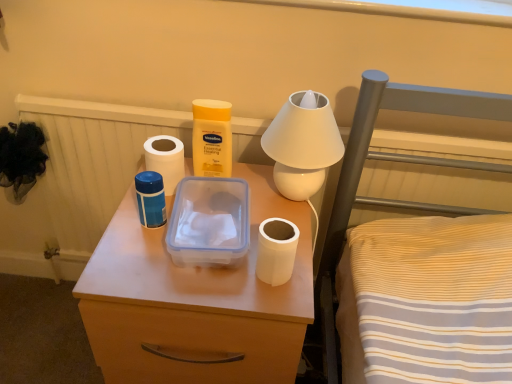
The width and height of the screenshot is (512, 384). In order to click on blue plastic thermos at center in this screenshot , I will do `click(151, 199)`.

What do you see at coordinates (276, 250) in the screenshot? This screenshot has width=512, height=384. I see `white matte toilet paper at center, arranged as the first toilet paper when viewed from the right` at bounding box center [276, 250].

What do you see at coordinates (302, 144) in the screenshot? Image resolution: width=512 pixels, height=384 pixels. I see `white glossy table lamp at upper center` at bounding box center [302, 144].

The image size is (512, 384). I want to click on white matte toilet paper at left, the 1th toilet paper positioned from the left, so click(165, 160).

Considering the positions of objects matte plastic container at center and blue plastic thermos at center in the image provided, who is more to the left, matte plastic container at center or blue plastic thermos at center?

blue plastic thermos at center.

From the image's perspective, is matte plastic container at center above or below blue plastic thermos at center?

Clearly, from the image's perspective, matte plastic container at center is below blue plastic thermos at center.

Considering the sizes of objects matte plastic container at center and blue plastic thermos at center in the image provided, who is thinner, matte plastic container at center or blue plastic thermos at center?

With smaller width is blue plastic thermos at center.

From a real-world perspective, is matte plastic container at center on top of blue plastic thermos at center?

No, from a real-world perspective, matte plastic container at center is not above blue plastic thermos at center.

Is white glossy table lamp at upper center facing towards white matte toilet paper at left, placed as the 1th toilet paper when sorted from back to front?

No, white glossy table lamp at upper center is not turned towards white matte toilet paper at left, placed as the 1th toilet paper when sorted from back to front.

Does white glossy table lamp at upper center have a smaller size compared to white matte toilet paper at left, positioned as the second toilet paper in bottom-to-top order?

No, white glossy table lamp at upper center is not smaller than white matte toilet paper at left, positioned as the second toilet paper in bottom-to-top order.

Is white glossy table lamp at upper center wider or thinner than white matte toilet paper at left, placed as the 1th toilet paper when sorted from back to front?

white glossy table lamp at upper center is wider than white matte toilet paper at left, placed as the 1th toilet paper when sorted from back to front.

Is white glossy table lamp at upper center shorter than white matte toilet paper at left, positioned as the second toilet paper in bottom-to-top order?

No.

Is white matte toilet paper at center, the second toilet paper viewed from the back, surrounding white glossy table lamp at upper center?

No, white glossy table lamp at upper center is not a part of white matte toilet paper at center, the second toilet paper viewed from the back.

Is white matte toilet paper at center, placed as the second toilet paper when sorted from left to right, to the left of white glossy table lamp at upper center from the viewer's perspective?

Indeed, white matte toilet paper at center, placed as the second toilet paper when sorted from left to right, is positioned on the left side of white glossy table lamp at upper center.

Is white matte toilet paper at center, which is the second toilet paper from top to bottom, positioned with its back to white glossy table lamp at upper center?

Yes.

Where is `table lamp behind the white matte toilet paper at center, arranged as the first toilet paper when viewed from the right`? This screenshot has width=512, height=384. table lamp behind the white matte toilet paper at center, arranged as the first toilet paper when viewed from the right is located at coordinates (302, 144).

How many degrees apart are the facing directions of blue plastic thermos at center and matte plastic container at center?

The angular difference between blue plastic thermos at center and matte plastic container at center is 0.00271 degrees.

Locate an element on the screen. Image resolution: width=512 pixels, height=384 pixels. cleaning product located above the matte plastic container at center (from the image's perspective) is located at coordinates (151, 199).

In the scene shown: From a real-world perspective, is blue plastic thermos at center positioned above or below matte plastic container at center?

blue plastic thermos at center is situated higher than matte plastic container at center in the real world.

Does point (151, 219) lie behind point (112, 352)?

That is True.

How far apart are white glossy table lamp at upper center and transparent plastic lunch box at center?

white glossy table lamp at upper center is 6.92 inches from transparent plastic lunch box at center.

Who is taller, white glossy table lamp at upper center or transparent plastic lunch box at center?

With more height is white glossy table lamp at upper center.

Is point (315, 171) more distant than point (220, 199)?

No, it is in front of (220, 199).

Is white glossy table lamp at upper center positioned before transparent plastic lunch box at center?

No, it is not.

Considering the relative sizes of blue plastic thermos at center and white glossy table lamp at upper center in the image provided, is blue plastic thermos at center taller than white glossy table lamp at upper center?

No, blue plastic thermos at center is not taller than white glossy table lamp at upper center.

Does blue plastic thermos at center appear on the right side of white glossy table lamp at upper center?

In fact, blue plastic thermos at center is to the left of white glossy table lamp at upper center.

From a real-world perspective, between blue plastic thermos at center and white glossy table lamp at upper center, who is vertically higher?

white glossy table lamp at upper center.

From the image's perspective, which object appears higher, blue plastic thermos at center or white glossy table lamp at upper center?

white glossy table lamp at upper center appears higher in the image.

Can you tell me how much blue plastic thermos at center and white matte toilet paper at center, arranged as the first toilet paper when viewed from the right, differ in facing direction?

The angular difference between blue plastic thermos at center and white matte toilet paper at center, arranged as the first toilet paper when viewed from the right, is 0.00211 degrees.

Is blue plastic thermos at center inside or outside of white matte toilet paper at center, placed as the second toilet paper when sorted from left to right?

blue plastic thermos at center is not enclosed by white matte toilet paper at center, placed as the second toilet paper when sorted from left to right.

This screenshot has width=512, height=384. I want to click on cleaning product located above the white matte toilet paper at center, which is the 1th toilet paper in bottom-to-top order (from a real-world perspective), so 151,199.

Considering the relative sizes of blue plastic thermos at center and white matte toilet paper at center, which is the second toilet paper from top to bottom, in the image provided, is blue plastic thermos at center thinner than white matte toilet paper at center, which is the second toilet paper from top to bottom,?

Correct, the width of blue plastic thermos at center is less than that of white matte toilet paper at center, which is the second toilet paper from top to bottom.

The width and height of the screenshot is (512, 384). In order to click on nightstand located on the right of blue plastic thermos at center in this screenshot , I will do [195, 302].

You are a GUI agent. You are given a task and a screenshot of the screen. Output one action in this format:
    pyautogui.click(x=<x>, y=<y>)
    Task: Click on the table lamp that appears above the white matte toilet paper at left, the second toilet paper from the front (from the image's perspective)
    The width and height of the screenshot is (512, 384).
    Given the screenshot: What is the action you would take?
    pyautogui.click(x=302, y=144)

When comparing their distances from white matte toilet paper at center, the second toilet paper viewed from the back, does transparent plastic lunch box at center or white glossy table lamp at upper center seem further?

white glossy table lamp at upper center is further to white matte toilet paper at center, the second toilet paper viewed from the back.

When comparing their distances from blue plastic thermos at center, does white matte toilet paper at left, arranged as the second toilet paper when viewed from the right, or matte plastic container at center seem closer?

white matte toilet paper at left, arranged as the second toilet paper when viewed from the right.

When comparing their distances from transparent plastic lunch box at center, does matte plastic container at center or white glossy table lamp at upper center seem closer?

The object closer to transparent plastic lunch box at center is matte plastic container at center.

From the image, which object appears to be nearer to white matte toilet paper at center, which is the second toilet paper from top to bottom, blue plastic thermos at center or white glossy table lamp at upper center?

white glossy table lamp at upper center is positioned closer to the anchor white matte toilet paper at center, which is the second toilet paper from top to bottom.

From the picture: Considering their positions, is blue plastic thermos at center positioned further to matte plastic container at center than white matte toilet paper at center, the second toilet paper viewed from the back?

Among the two, blue plastic thermos at center is located further to matte plastic container at center.

Which object lies further to the anchor point white matte toilet paper at center, the second toilet paper viewed from the back, blue plastic thermos at center or matte plastic container at center?

blue plastic thermos at center is positioned further to the anchor white matte toilet paper at center, the second toilet paper viewed from the back.

Consider the image. When comparing their distances from blue plastic thermos at center, does white matte toilet paper at left, positioned as the 1th toilet paper in top-to-bottom order, or white glossy table lamp at upper center seem further?

The object further to blue plastic thermos at center is white glossy table lamp at upper center.

Which object lies nearer to the anchor point white matte toilet paper at left, the second toilet paper from the front, white matte toilet paper at center, which is the 1th toilet paper in bottom-to-top order, or blue plastic thermos at center?

The object closer to white matte toilet paper at left, the second toilet paper from the front, is blue plastic thermos at center.

Where is `lunch box located between white matte toilet paper at left, the 1th toilet paper positioned from the left, and white glossy table lamp at upper center in the left-right direction`? Image resolution: width=512 pixels, height=384 pixels. lunch box located between white matte toilet paper at left, the 1th toilet paper positioned from the left, and white glossy table lamp at upper center in the left-right direction is located at coordinates (209, 221).

Identify the location of cleaning product between white glossy table lamp at upper center and matte plastic container at center in the up-down direction. (151, 199).

Image resolution: width=512 pixels, height=384 pixels. Identify the location of cleaning product between white matte toilet paper at left, arranged as the second toilet paper when viewed from the right, and matte plastic container at center in the up-down direction. (151, 199).

The height and width of the screenshot is (384, 512). I want to click on lunch box between white matte toilet paper at left, the 1th toilet paper positioned from the left, and matte plastic container at center vertically, so click(209, 221).